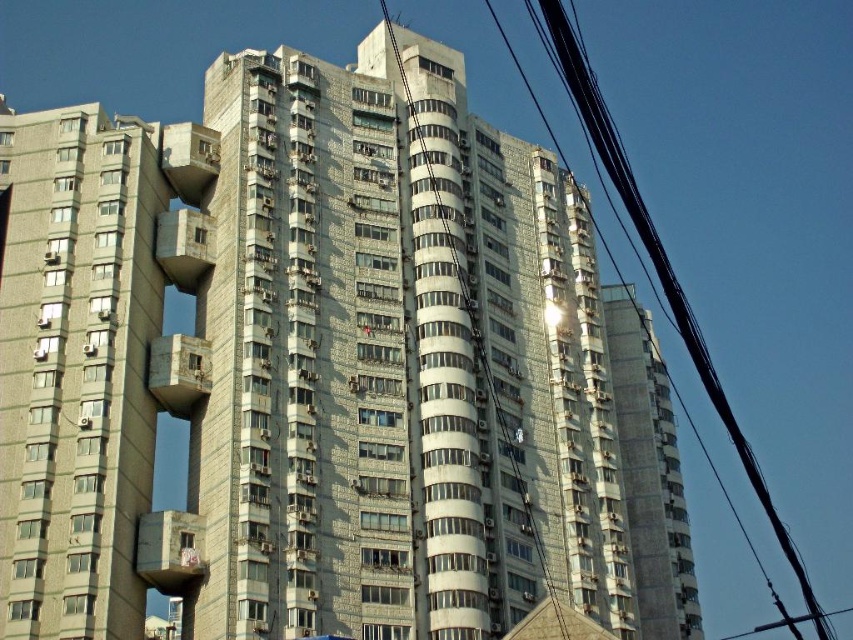
Question: Is black wire at upper right closer to camera compared to metallic wire at center?

Choices:
 (A) no
 (B) yes

Answer: (B)

Question: Is black wire at upper right positioned in front of metallic wire at center?

Choices:
 (A) yes
 (B) no

Answer: (A)

Question: Which point is closer to the camera?

Choices:
 (A) black wire at upper right
 (B) metallic wire at center

Answer: (A)

Question: Which of the following is the farthest from the observer?

Choices:
 (A) black wire at upper right
 (B) metallic wire at center

Answer: (B)

Question: Can you confirm if black wire at upper right is smaller than metallic wire at center?

Choices:
 (A) no
 (B) yes

Answer: (A)